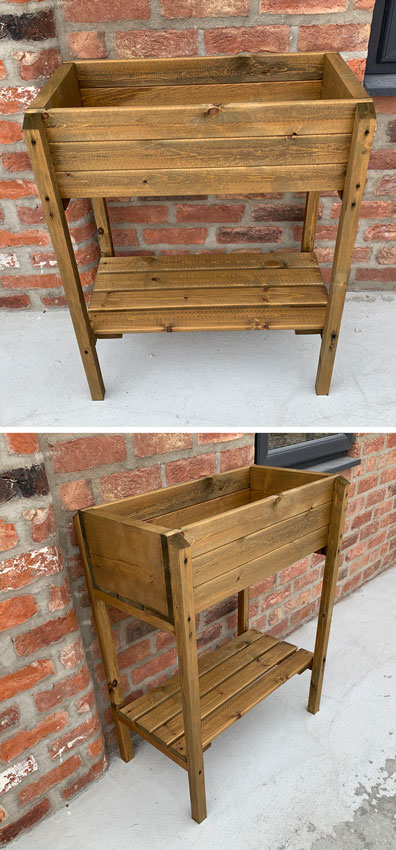
The image size is (396, 850). I want to click on table shelf, so click(229, 689).